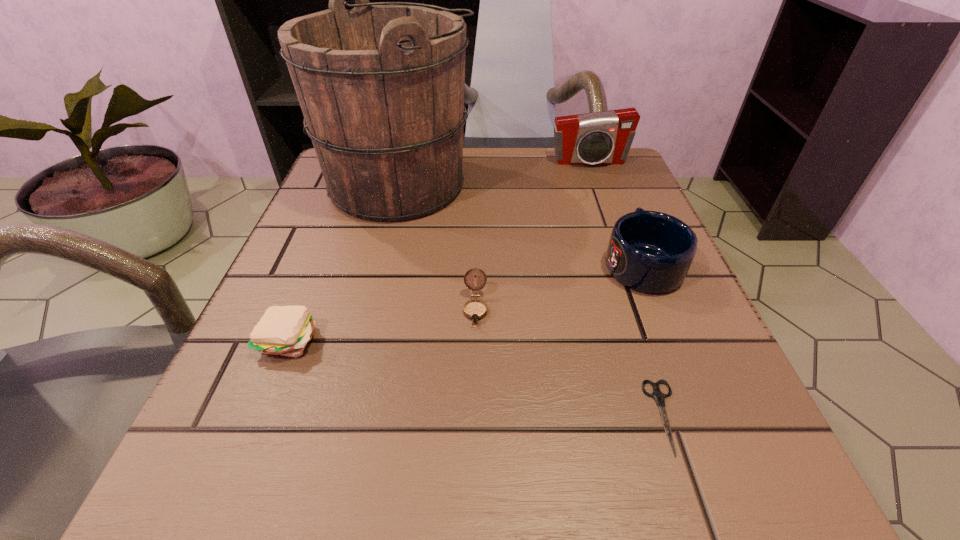
Where is `free point between the camera and the third tallest object`? free point between the camera and the third tallest object is located at coordinates (615, 213).

I want to click on empty space between the mug and the nearest object, so click(x=654, y=340).

What are the coordinates of `the fifth closest object relative to the compass` in the screenshot? It's located at (601, 138).

Identify the location of object that is the second closest to the camera. (651, 252).

This screenshot has width=960, height=540. Find the location of `vacant position in the image that satisfies the following two spatial constraints: 1. on the face of the shears; 2. on the right side of the compass`. vacant position in the image that satisfies the following two spatial constraints: 1. on the face of the shears; 2. on the right side of the compass is located at coordinates (474, 417).